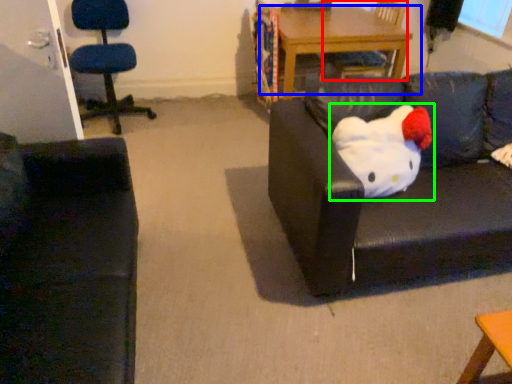
Question: Based on their relative distances, which object is farther from chair (highlighted by a red box)? Choose from table (highlighted by a blue box) and toy (highlighted by a green box).

Choices:
 (A) table
 (B) toy

Answer: (B)